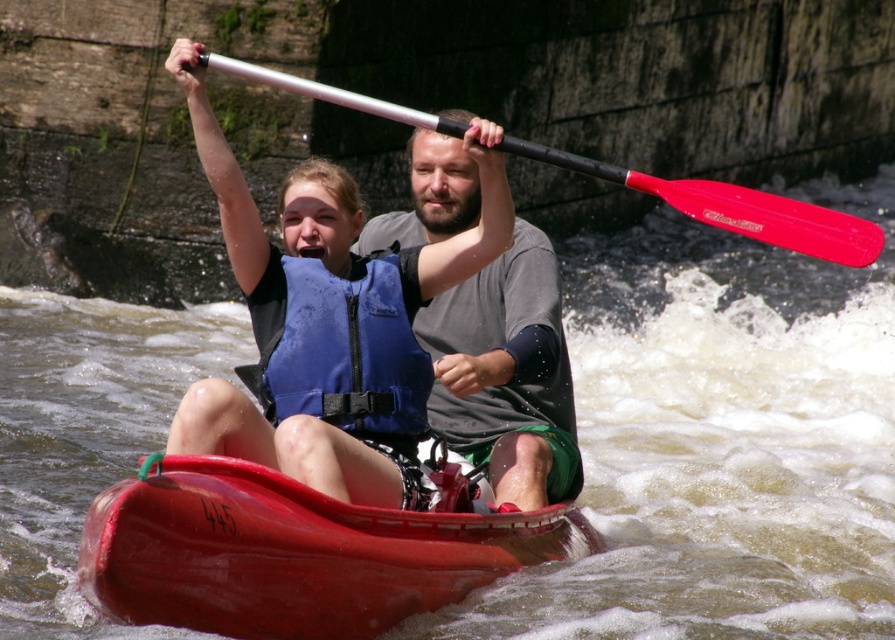
Can you confirm if blue life vest at center is positioned to the right of blue matte life jacket at center?

In fact, blue life vest at center is to the left of blue matte life jacket at center.

Who is positioned more to the left, blue life vest at center or blue matte life jacket at center?

blue life vest at center

Identify the location of blue life vest at center. This screenshot has width=895, height=640. (329, 321).

Can you confirm if brown textured water at center is positioned to the right of metallic paddle at upper center?

Correct, you'll find brown textured water at center to the right of metallic paddle at upper center.

I want to click on brown textured water at center, so click(720, 440).

Who is lower down, brown textured water at center or blue matte life jacket at center?

Positioned lower is blue matte life jacket at center.

Which is behind, point (871, 554) or point (374, 369)?

Positioned behind is point (871, 554).

Is point (627, 502) closer to viewer compared to point (265, 273)?

No, it is not.

At what (x,y) coordinates should I click in order to perform the action: click on brown textured water at center. Please return your answer as a coordinate pair (x, y). This screenshot has width=895, height=640. Looking at the image, I should click on (720, 440).